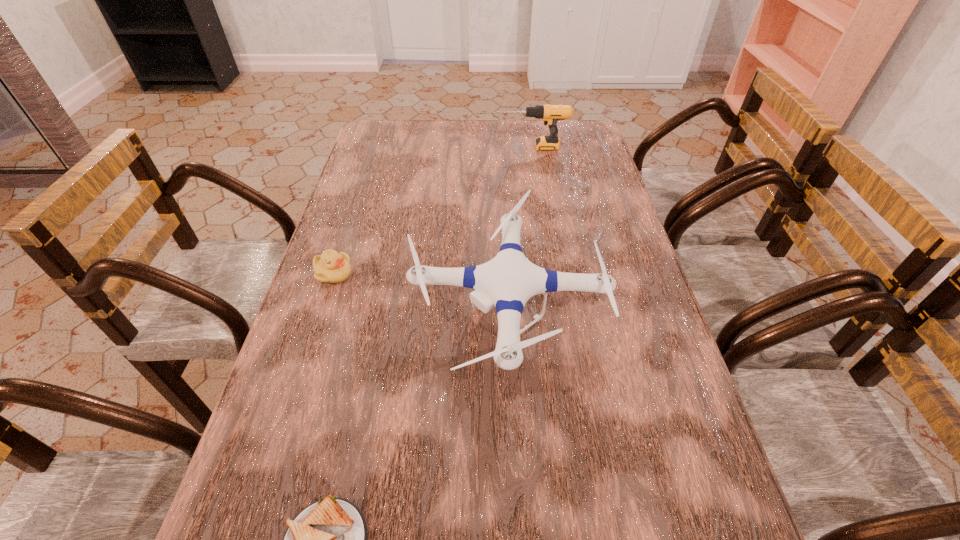
Find the location of a particular element. object that is the second closest to the farthest object is located at coordinates (331, 267).

This screenshot has height=540, width=960. I want to click on the third closest object to the drone, so click(550, 114).

Identify the location of free location that satisfies the following two spatial constraints: 1. on the back side of the drone; 2. on the beak of the third tallest object. This screenshot has height=540, width=960. (504, 274).

Locate an element on the screen. The image size is (960, 540). vacant position in the image that satisfies the following two spatial constraints: 1. on the beak of the drone; 2. on the right side of the duckling is located at coordinates (324, 305).